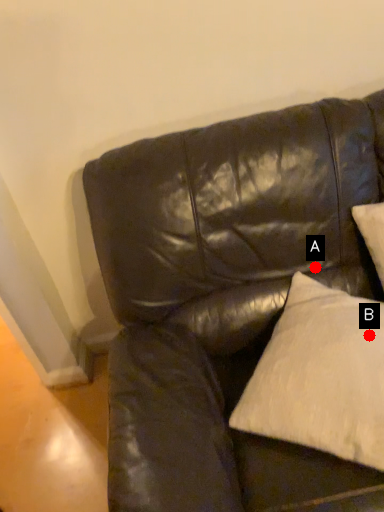
Question: Two points are circled on the image, labeled by A and B beside each circle. Among these points, which one is farthest from the camera?

Choices:
 (A) A is further
 (B) B is further

Answer: (A)